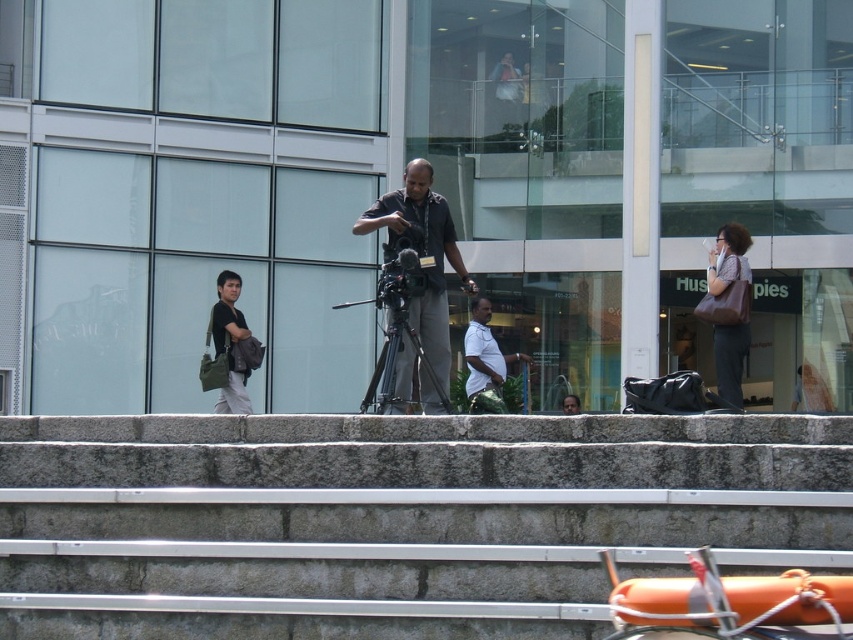
Question: Can you confirm if matte black camera at center is positioned to the right of brown leather bag at right?

Choices:
 (A) no
 (B) yes

Answer: (A)

Question: Based on their relative distances, which object is nearer to the brown leather bag at right?

Choices:
 (A) black matte tripod at center
 (B) matte black camera at center
 (C) light blue shirt at center
 (D) dark gray shirt at center

Answer: (B)

Question: Is matte black camera at center to the right of metallic silver video camera at center from the viewer's perspective?

Choices:
 (A) yes
 (B) no

Answer: (A)

Question: Among these points, which one is nearest to the camera?

Choices:
 (A) (376, 291)
 (B) (575, 400)
 (C) (746, 232)

Answer: (C)

Question: Which of the following is the farthest from the observer?

Choices:
 (A) (386, 336)
 (B) (399, 385)

Answer: (B)

Question: Is brown leather bag at right smaller than light blue shirt at center?

Choices:
 (A) no
 (B) yes

Answer: (B)